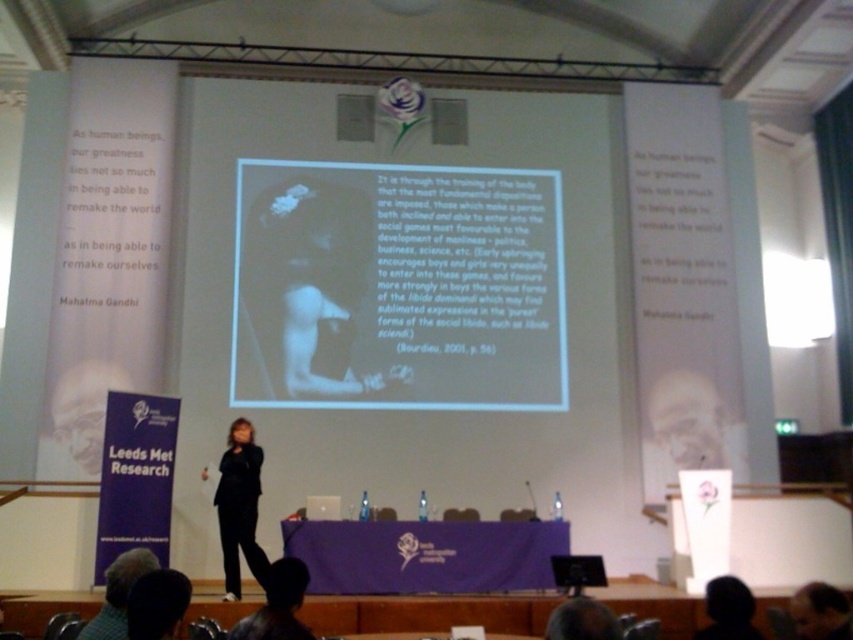
Question: Can you confirm if black matte head at lower right is smaller than dark brown hair at lower center?

Choices:
 (A) yes
 (B) no

Answer: (B)

Question: Which object appears farthest from the camera in this image?

Choices:
 (A) black matte head at lower right
 (B) green checkered shirt at lower left

Answer: (A)

Question: Where is white paper at center located in relation to smooth skin face at upper right in the image?

Choices:
 (A) left
 (B) right

Answer: (A)

Question: Which of these objects is positioned closest to the dark brown hair at lower center?

Choices:
 (A) smooth skin face at upper right
 (B) black fabric suit at center

Answer: (B)

Question: Can you confirm if dark fabric jacket at lower center is wider than dark brown hair at lower center?

Choices:
 (A) yes
 (B) no

Answer: (A)

Question: Which object appears farthest from the camera in this image?

Choices:
 (A) black matte head at lower right
 (B) green checkered shirt at lower left
 (C) black suit at center
 (D) white paper at center

Answer: (D)